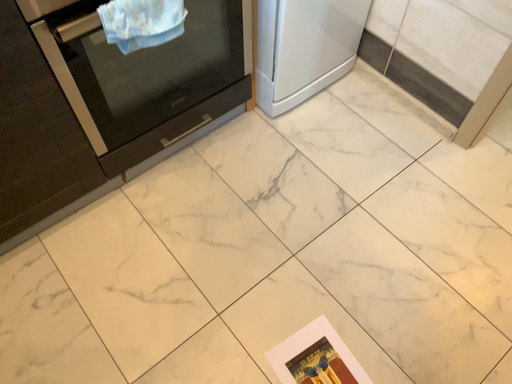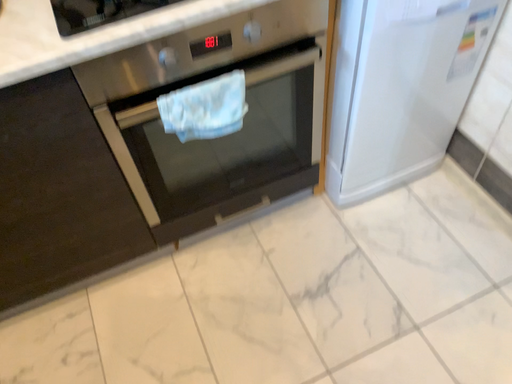
Question: How did the camera likely rotate when shooting the video?

Choices:
 (A) rotated left
 (B) rotated right

Answer: (A)